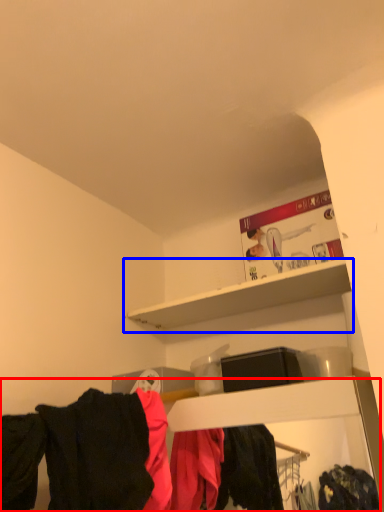
Question: Which point is further to the camera, closet (highlighted by a red box) or shelf (highlighted by a blue box)?

Choices:
 (A) closet
 (B) shelf

Answer: (B)